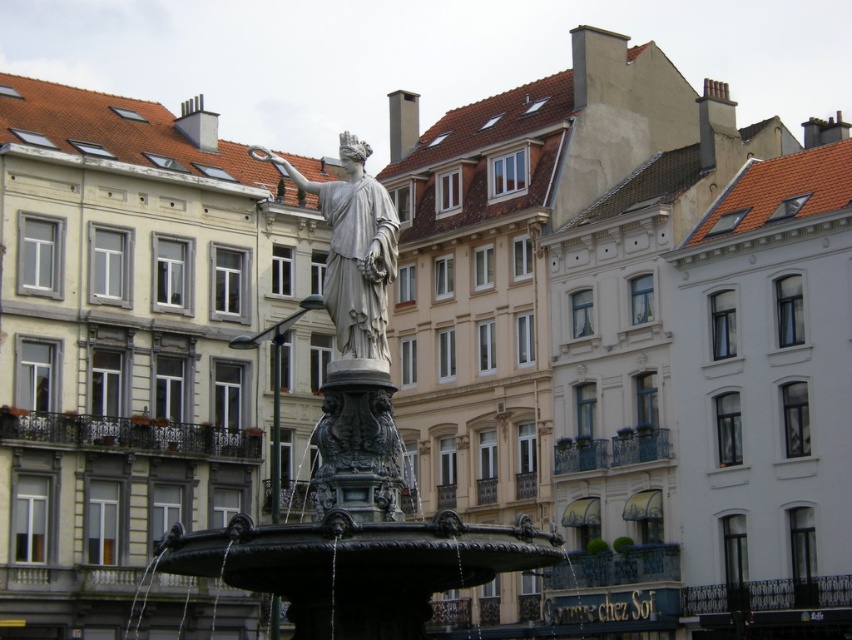
You are a city planner assessing the space around the bronze fountain at center and the white marble statue at center. If you want to install a new bench that requires at least 2 meters of space between it and any object, which object should you place the bench closer to?

The bronze fountain at center has a larger width than the white marble statue at center, so placing the bench closer to the white marble statue at center would maintain the required 2 meters distance from the larger bronze fountain at center.

You are standing at the point marked by the coordinates point (355, 467) in the image. What object are you directly at?

You are directly at the bronze fountain at center, as the point (355, 467) marks its location.